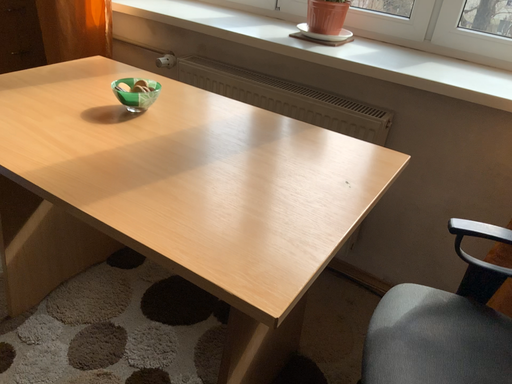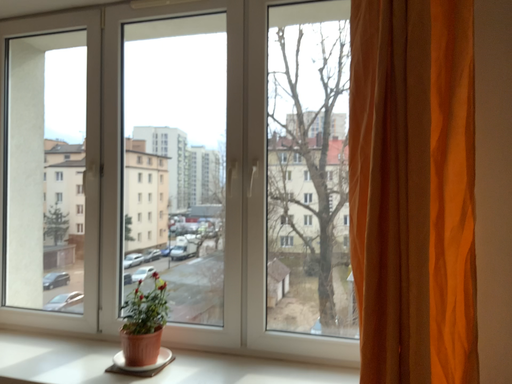
Question: How did the camera likely rotate when shooting the video?

Choices:
 (A) rotated downward
 (B) rotated upward

Answer: (B)